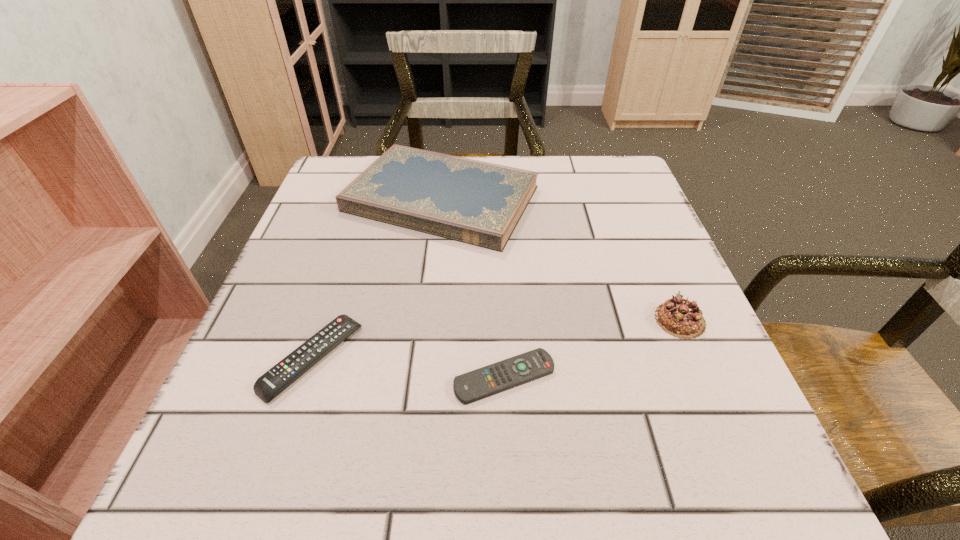
Image resolution: width=960 pixels, height=540 pixels. In order to click on vacant space that is in between the farthest object and the taller remote control in this screenshot , I will do `click(377, 279)`.

Locate which object ranks second in proximity to the left remote control. Please provide its 2D coordinates. Your answer should be formatted as a tuple, i.e. [(x, y)], where the tuple contains the x and y coordinates of a point satisfying the conditions above.

[(480, 203)]

The height and width of the screenshot is (540, 960). I want to click on object that is the third closest to the chocolate cake, so click(x=268, y=386).

Where is `free space that satisfies the following two spatial constraints: 1. on the front side of the paperback book; 2. on the right side of the shorter remote control`? The height and width of the screenshot is (540, 960). free space that satisfies the following two spatial constraints: 1. on the front side of the paperback book; 2. on the right side of the shorter remote control is located at coordinates (422, 377).

At what (x,y) coordinates should I click in order to perform the action: click on blank space that satisfies the following two spatial constraints: 1. on the back side of the left remote control; 2. on the right side of the rightmost object. Please return your answer as a coordinate pair (x, y). Image resolution: width=960 pixels, height=540 pixels. Looking at the image, I should click on (324, 320).

Find the location of `vacant space that satisfies the following two spatial constraints: 1. on the front side of the taller remote control; 2. on the right side of the shorter remote control`. vacant space that satisfies the following two spatial constraints: 1. on the front side of the taller remote control; 2. on the right side of the shorter remote control is located at coordinates (306, 377).

Identify the location of vacant region that satisfies the following two spatial constraints: 1. on the back side of the chocolate cake; 2. on the left side of the shortest object. (502, 320).